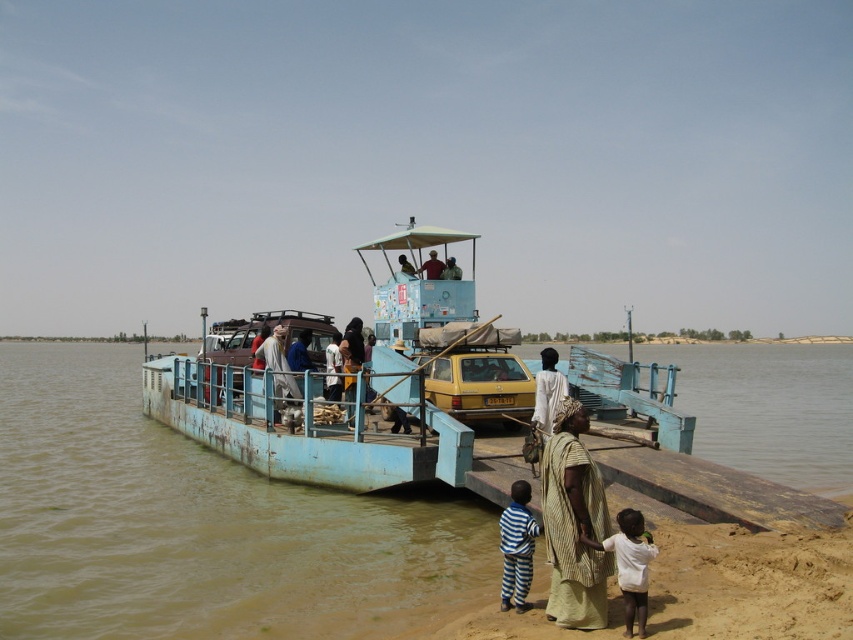
You are standing on the ferry and want to take a photo of the striped fabric pants at lower center. If your camera has a maximum focus range of 6 meters, will you be able to capture a clear photo?

The striped fabric pants at lower center are 6.82 meters away from the viewer. Since the camera can only focus up to 6 meters, it won t be able to capture a clear photo.

You are a passenger on the ferry and want to know which item is taller between the light brown fabric cloth at center and the matte blue shirt at center. Can you tell me?

The light brown fabric cloth at center is taller than the matte blue shirt at center.